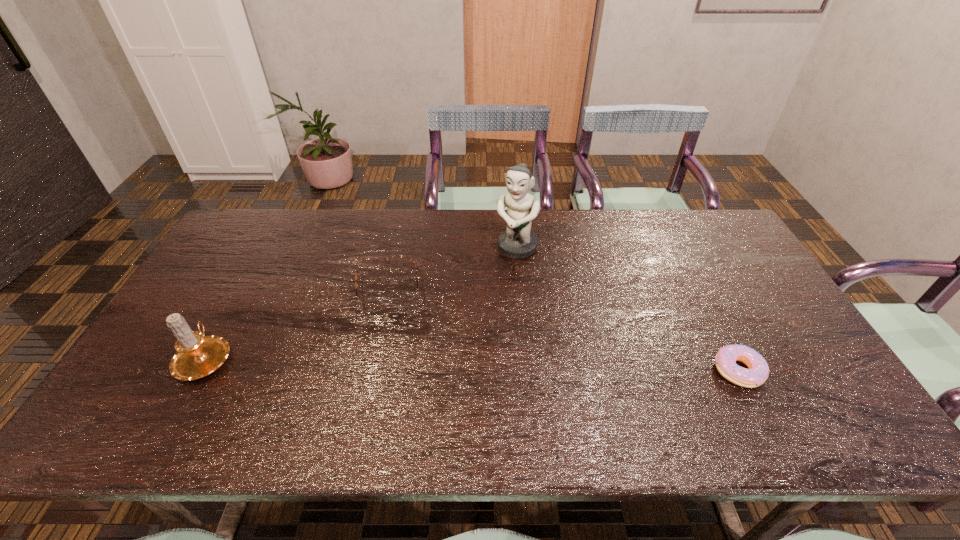
In order to click on free location located on the front-facing side of the tallest object in this screenshot , I will do `click(492, 292)`.

This screenshot has width=960, height=540. What are the coordinates of `vacant position located on the front-facing side of the tallest object` in the screenshot? It's located at (484, 305).

Identify the location of vacant area located on the front-facing side of the tallest object. The height and width of the screenshot is (540, 960). (467, 335).

This screenshot has width=960, height=540. Find the location of `free space located 0.070m on the front-facing side of the second shortest object`. free space located 0.070m on the front-facing side of the second shortest object is located at coordinates (393, 334).

The height and width of the screenshot is (540, 960). I want to click on blank space located on the front-facing side of the second shortest object, so click(396, 395).

Identify the location of vacant space situated 0.280m on the front-facing side of the second shortest object. (397, 402).

Locate an element on the screen. The width and height of the screenshot is (960, 540). object present at the far edge is located at coordinates (518, 241).

Locate an element on the screen. The image size is (960, 540). candle situated at the near edge is located at coordinates (197, 356).

Locate an element on the screen. doughnut situated at the near edge is located at coordinates (725, 360).

Where is `object located at the left edge`? object located at the left edge is located at coordinates (197, 356).